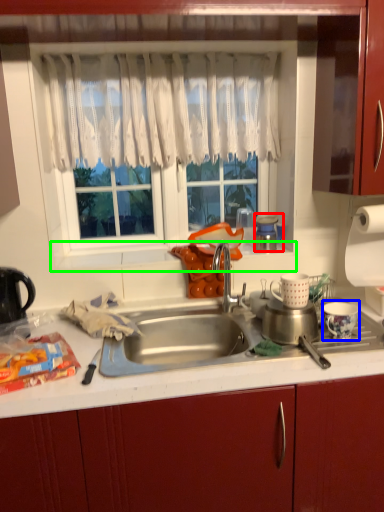
Question: Estimate the real-world distances between objects in this image. Which object is farther from appliance (highlighted by a red box), appliance (highlighted by a blue box) or window sill (highlighted by a green box)?

Choices:
 (A) appliance
 (B) window sill

Answer: (A)